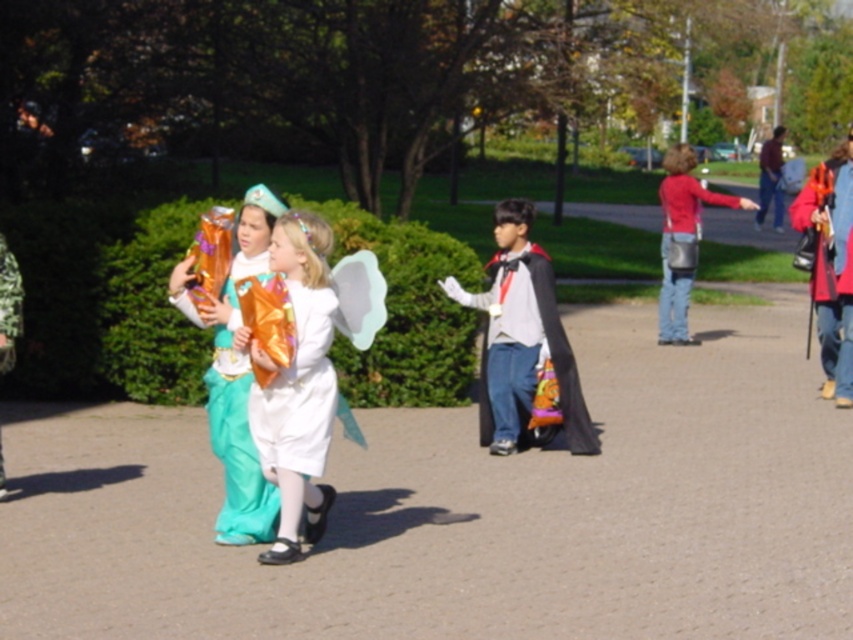
Question: From the image, what is the correct spatial relationship of smooth concrete path at center in relation to orange shiny umbrella at right?

Choices:
 (A) right
 (B) left

Answer: (B)

Question: Based on their relative distances, which object is farther from the matte red sweater at center?

Choices:
 (A) black matte cape at center
 (B) velvet red cape at right

Answer: (A)

Question: Which of the following is the closest to the observer?

Choices:
 (A) (845, 344)
 (B) (283, 422)
 (C) (648, 404)

Answer: (B)

Question: Can you confirm if black matte cape at center is positioned above velvet red cape at right?

Choices:
 (A) no
 (B) yes

Answer: (A)

Question: Based on their relative distances, which object is farther from the velvet red cape at right?

Choices:
 (A) black matte cape at center
 (B) matte red sweater at center

Answer: (B)

Question: Is black matte cape at center closer to camera compared to shiny gold wings at center?

Choices:
 (A) yes
 (B) no

Answer: (B)